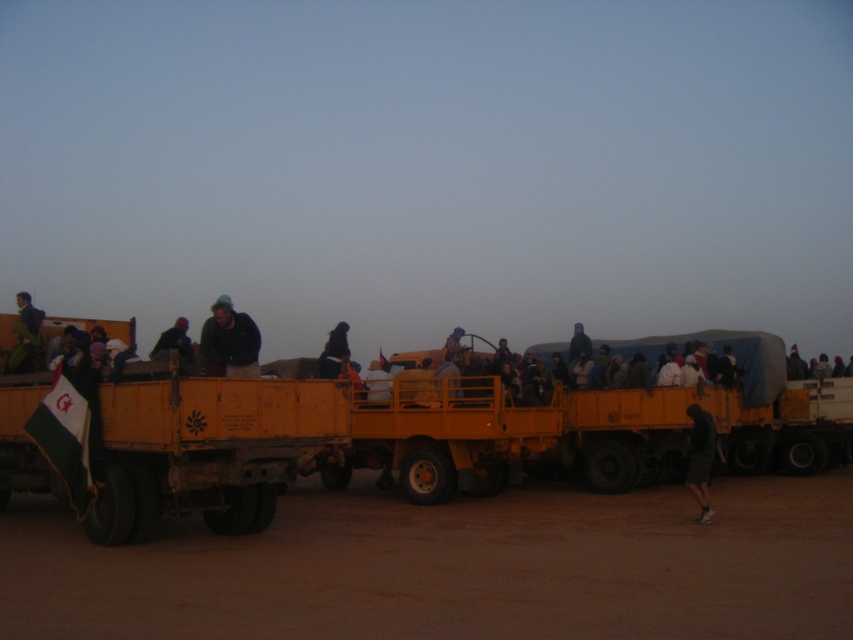
Between matte black jacket at center and black fabric at center, which one appears on the right side from the viewer's perspective?

From the viewer's perspective, black fabric at center appears more on the right side.

Measure the distance from matte black jacket at center to black fabric at center.

matte black jacket at center is 7.19 meters from black fabric at center.

You are a GUI agent. You are given a task and a screenshot of the screen. Output one action in this format:
    pyautogui.click(x=<x>, y=<y>)
    Task: Click on the matte black jacket at center
    Image resolution: width=853 pixels, height=640 pixels.
    Given the screenshot: What is the action you would take?
    pyautogui.click(x=175, y=346)

Does matte yellow truck at center appear on the right side of light brown leather jacket at center?

Correct, you'll find matte yellow truck at center to the right of light brown leather jacket at center.

Is matte yellow truck at center taller than light brown leather jacket at center?

Yes, matte yellow truck at center is taller than light brown leather jacket at center.

Between point (119, 490) and point (467, 346), which one is positioned in front?

Point (119, 490) is more forward.

Locate an element on the screen. This screenshot has width=853, height=640. matte yellow truck at center is located at coordinates (399, 440).

Image resolution: width=853 pixels, height=640 pixels. What do you see at coordinates (700, 458) in the screenshot?
I see `black matte shorts at lower right` at bounding box center [700, 458].

Locate an element on the screen. black matte shorts at lower right is located at coordinates (700, 458).

Who is more forward, (691,412) or (457,328)?

Positioned in front is point (691,412).

In order to click on black matte shorts at lower right in this screenshot , I will do `click(700, 458)`.